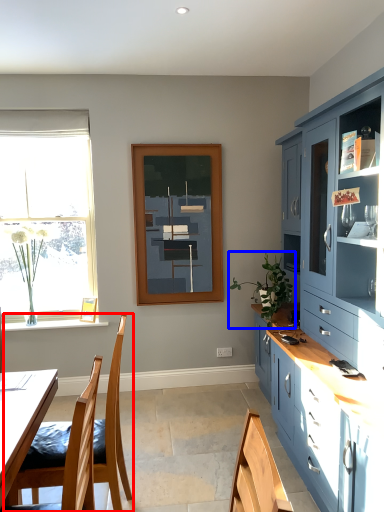
Question: Which of the following is the farthest to the observer, chair (highlighted by a red box) or houseplant (highlighted by a blue box)?

Choices:
 (A) chair
 (B) houseplant

Answer: (B)